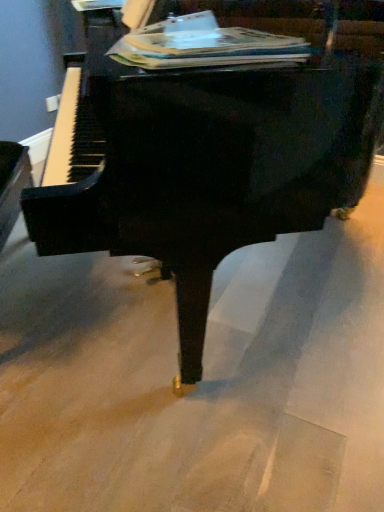
Image resolution: width=384 pixels, height=512 pixels. Describe the element at coordinates (210, 141) in the screenshot. I see `black polished piano at center` at that location.

What are the coordinates of `black polished piano at center` in the screenshot? It's located at [x=210, y=141].

Locate an element on the screen. Image resolution: width=384 pixels, height=512 pixels. paperback book at upper center is located at coordinates (204, 45).

Describe the element at coordinates (204, 45) in the screenshot. The image size is (384, 512). I see `paperback book at upper center` at that location.

What is the approximate height of paperback book at upper center?

2.85 inches.

You are a GUI agent. You are given a task and a screenshot of the screen. Output one action in this format:
    pyautogui.click(x=<x>, y=<y>)
    Task: Click on the black polished piano at center
    Image resolution: width=384 pixels, height=512 pixels.
    Given the screenshot: What is the action you would take?
    pyautogui.click(x=210, y=141)

Which is more to the right, paperback book at upper center or black polished piano at center?

black polished piano at center is more to the right.

Considering the relative positions of paperback book at upper center and black polished piano at center in the image provided, is paperback book at upper center in front of black polished piano at center?

No, it is not.

Is point (130, 47) closer or farther from the camera than point (170, 187)?

Clearly, point (130, 47) is more distant from the camera than point (170, 187).

From the image's perspective, would you say paperback book at upper center is positioned over black polished piano at center?

Yes.

From a real-world perspective, relative to black polished piano at center, is paperback book at upper center vertically above or below?

From a real-world perspective, paperback book at upper center is physically above black polished piano at center.

Can you confirm if paperback book at upper center is wider than black polished piano at center?

No.

Can you confirm if paperback book at upper center is taller than black polished piano at center?

No, paperback book at upper center is not taller than black polished piano at center.

Considering the relative sizes of paperback book at upper center and black polished piano at center in the image provided, is paperback book at upper center smaller than black polished piano at center?

Yes.

Choose the correct answer: Is paperback book at upper center inside black polished piano at center or outside it?

paperback book at upper center exists entirely within black polished piano at center.

Can you see paperback book at upper center touching black polished piano at center?

No, paperback book at upper center is not beside black polished piano at center.

Is paperback book at upper center facing away from black polished piano at center?

That's right, paperback book at upper center is facing away from black polished piano at center.

Find the location of a particular element. piano on the right side of paperback book at upper center is located at coordinates (210, 141).

Between black polished piano at center and paperback book at upper center, which one appears on the right side from the viewer's perspective?

black polished piano at center is more to the right.

Is the depth of black polished piano at center greater than that of paperback book at upper center?

No, black polished piano at center is closer to the camera.

Is point (191, 108) farther from camera compared to point (208, 49)?

No, (191, 108) is in front of (208, 49).

From the image's perspective, who appears lower, black polished piano at center or paperback book at upper center?

black polished piano at center is shown below in the image.

From a real-world perspective, which object rests below the other?

From a 3D spatial view, black polished piano at center is below.

Between black polished piano at center and paperback book at upper center, which one has smaller width?

Thinner between the two is paperback book at upper center.

Is black polished piano at center shorter than paperback book at upper center?

In fact, black polished piano at center may be taller than paperback book at upper center.

Based on the photo, who is bigger, black polished piano at center or paperback book at upper center?

With larger size is black polished piano at center.

Is black polished piano at center located outside paperback book at upper center?

Yes, black polished piano at center is outside of paperback book at upper center.

Is black polished piano at center beside paperback book at upper center?

No, black polished piano at center is not in contact with paperback book at upper center.

Is black polished piano at center oriented away from paperback book at upper center?

That's not correct — black polished piano at center is not looking away from paperback book at upper center.

How different are the orientations of black polished piano at center and paperback book at upper center in degrees?

There is a 17-degree angle between the facing directions of black polished piano at center and paperback book at upper center.

Where is `piano in front of the paperback book at upper center`? The height and width of the screenshot is (512, 384). piano in front of the paperback book at upper center is located at coordinates (210, 141).

At what (x,y) coordinates should I click in order to perform the action: click on piano below the paperback book at upper center (from the image's perspective). Please return your answer as a coordinate pair (x, y). Image resolution: width=384 pixels, height=512 pixels. Looking at the image, I should click on (210, 141).

What are the coordinates of `piano lying in front of the paperback book at upper center` in the screenshot? It's located at (210, 141).